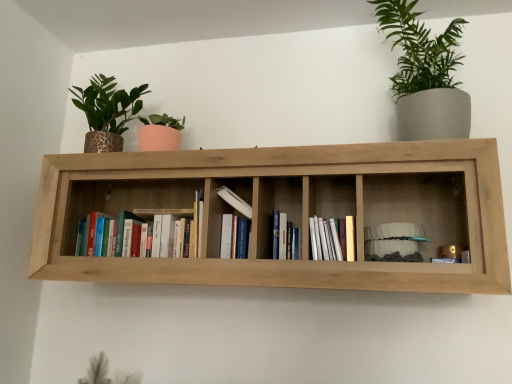
Question: Which direction should I rotate to look at hardcover books at center, which ranks as the fifth book in right-to-left order?

Choices:
 (A) left
 (B) right

Answer: (A)

Question: From the image's perspective, does hardcover book at center, marked as the third book in a right-to-left arrangement, appear higher than hardcover books at center, which ranks as the fifth book in right-to-left order?

Choices:
 (A) no
 (B) yes

Answer: (A)

Question: Can you confirm if hardcover book at center, marked as the third book in a right-to-left arrangement, is wider than hardcover books at center, which ranks as the fifth book in right-to-left order?

Choices:
 (A) yes
 (B) no

Answer: (B)

Question: Considering the relative positions of hardcover book at center, which is the 3th book in left-to-right order, and hardcover books at center, the first book positioned from the left, in the image provided, is hardcover book at center, which is the 3th book in left-to-right order, to the right of hardcover books at center, the first book positioned from the left, from the viewer's perspective?

Choices:
 (A) no
 (B) yes

Answer: (B)

Question: From the image's perspective, is hardcover book at center, which is the 3th book in left-to-right order, beneath hardcover books at center, which ranks as the fifth book in right-to-left order?

Choices:
 (A) no
 (B) yes

Answer: (B)

Question: Are hardcover book at center, which is the 3th book in left-to-right order, and hardcover books at center, which ranks as the fifth book in right-to-left order, beside each other?

Choices:
 (A) yes
 (B) no

Answer: (B)

Question: Is white matte stack of plates at right, arranged as the 5th book when viewed from the left, not close to white matte book at center, which appears as the 4th book when viewed from the right?

Choices:
 (A) no
 (B) yes

Answer: (A)

Question: Is white matte stack of plates at right, arranged as the 5th book when viewed from the left, closer to the viewer compared to white matte book at center, the 2th book viewed from the left?

Choices:
 (A) no
 (B) yes

Answer: (B)

Question: Considering the relative sizes of white matte stack of plates at right, marked as the 1th book in a right-to-left arrangement, and white matte book at center, the 2th book viewed from the left, in the image provided, is white matte stack of plates at right, marked as the 1th book in a right-to-left arrangement, taller than white matte book at center, the 2th book viewed from the left,?

Choices:
 (A) no
 (B) yes

Answer: (A)

Question: Does white matte stack of plates at right, marked as the 1th book in a right-to-left arrangement, turn towards white matte book at center, the 2th book viewed from the left?

Choices:
 (A) yes
 (B) no

Answer: (B)

Question: From a real-world perspective, is white matte stack of plates at right, marked as the 1th book in a right-to-left arrangement, located beneath white matte book at center, which appears as the 4th book when viewed from the right?

Choices:
 (A) no
 (B) yes

Answer: (B)

Question: Is white matte stack of plates at right, arranged as the 5th book when viewed from the left, not within white matte book at center, the 2th book viewed from the left?

Choices:
 (A) no
 (B) yes

Answer: (B)

Question: From a real-world perspective, is hardcover books at center, the first book positioned from the left, under white paper at center, positioned as the fourth book in left-to-right order?

Choices:
 (A) no
 (B) yes

Answer: (A)